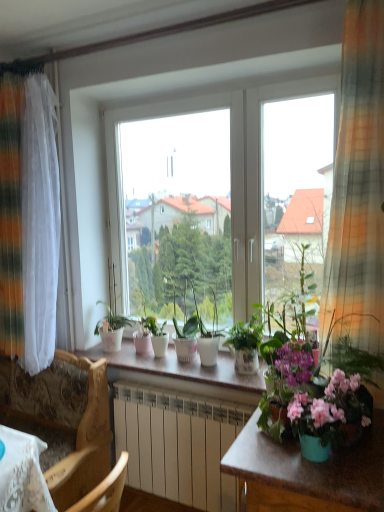
Image resolution: width=384 pixels, height=512 pixels. I want to click on free space in front of white glossy pot at center, the first houseplant when ordered from left to right, so click(113, 355).